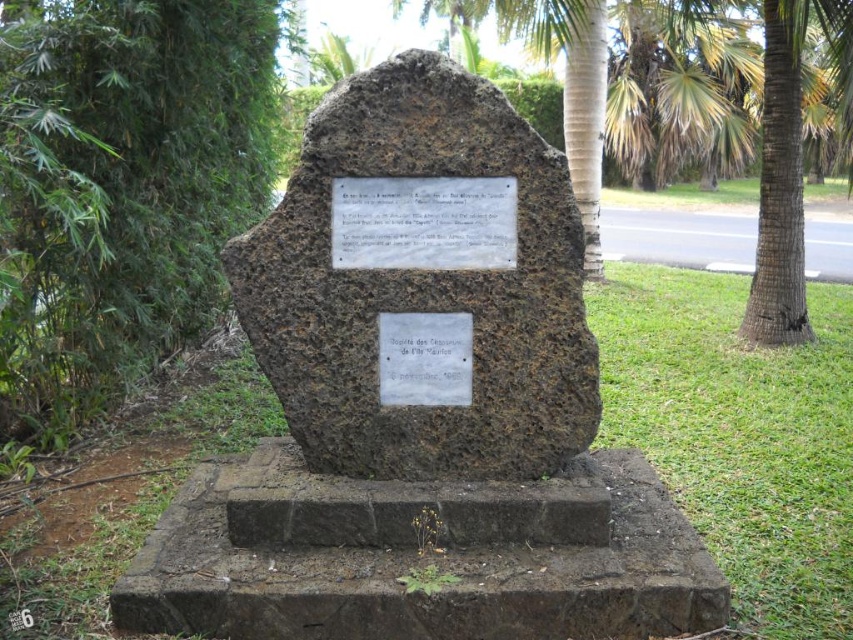
Can you confirm if green leafy tree at left is bigger than white stone plaque at center?

Correct, green leafy tree at left is larger in size than white stone plaque at center.

In the scene shown: Who is more distant from viewer, (21, 154) or (428, 250)?

Point (21, 154)

This screenshot has height=640, width=853. What do you see at coordinates (120, 188) in the screenshot?
I see `green leafy tree at left` at bounding box center [120, 188].

In order to click on green leafy tree at left in this screenshot , I will do `click(120, 188)`.

Is brown rough stone monument at center to the right of white metal plaque at center from the viewer's perspective?

Yes, brown rough stone monument at center is to the right of white metal plaque at center.

Can you confirm if brown rough stone monument at center is positioned below white metal plaque at center?

Incorrect, brown rough stone monument at center is not positioned below white metal plaque at center.

Image resolution: width=853 pixels, height=640 pixels. Describe the element at coordinates (422, 285) in the screenshot. I see `brown rough stone monument at center` at that location.

Where is `brown rough stone monument at center`? The image size is (853, 640). brown rough stone monument at center is located at coordinates (422, 285).

Who is lower down, brown rough stone monument at center or green leafy tree at left?

brown rough stone monument at center

Which is behind, point (257, 294) or point (106, 317)?

Positioned behind is point (106, 317).

Where is `brown rough stone monument at center`? This screenshot has height=640, width=853. brown rough stone monument at center is located at coordinates (422, 285).